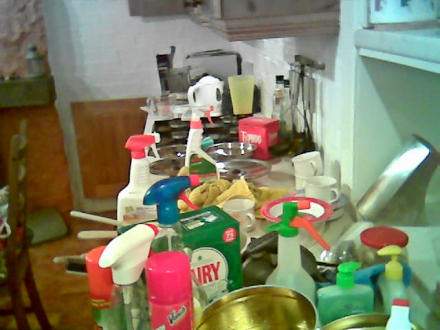
Where is `box`? This screenshot has width=440, height=330. box is located at coordinates (201, 243).